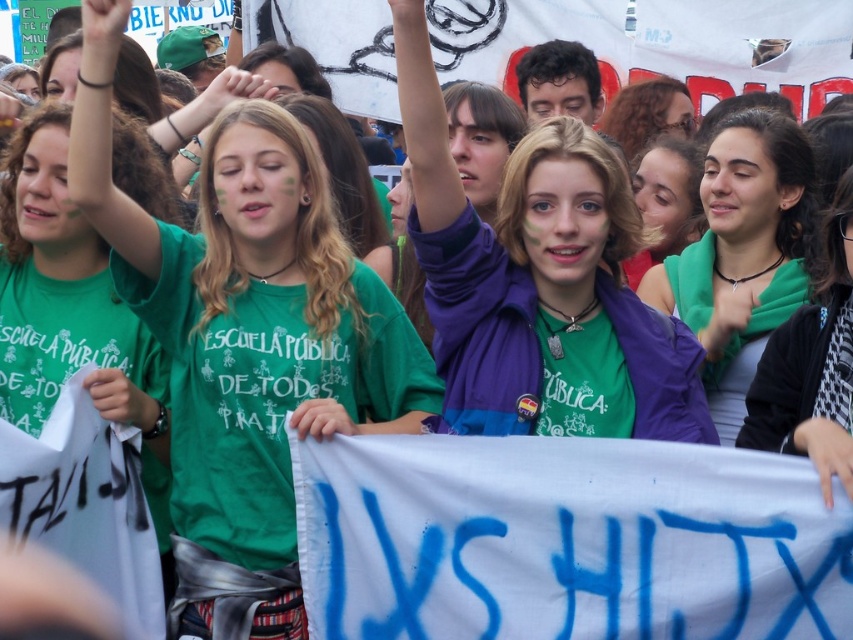
You are a photographer standing at the center of the protest area. You want to take a photo that includes both the green matte shirt at upper right and the blonde hair at upper center. Given that your camera has a maximum zoom range of 100 feet, will you be able to capture both subjects in a single frame without moving closer?

The distance between the green matte shirt at upper right and the blonde hair at upper center is 89.83 feet. Since your camera can zoom up to 100 feet, you can capture both subjects in a single frame without moving closer.